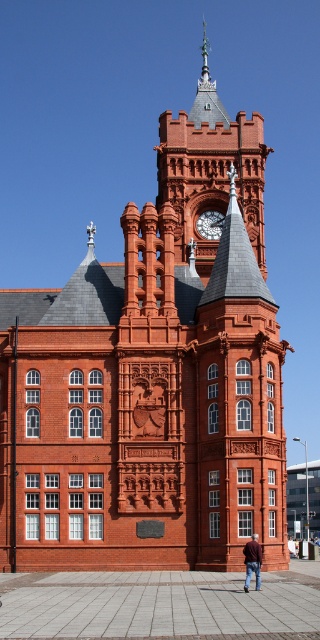
Question: Which object appears farthest from the camera in this image?

Choices:
 (A) brown leather jacket at lower center
 (B) polished brass clock at upper center

Answer: (B)

Question: Which object appears closest to the camera in this image?

Choices:
 (A) polished brass clock at upper center
 (B) brown leather jacket at lower center

Answer: (B)

Question: Is brown leather jacket at lower center behind polished brass clock at upper center?

Choices:
 (A) no
 (B) yes

Answer: (A)

Question: Can you confirm if brown leather jacket at lower center is thinner than polished brass clock at upper center?

Choices:
 (A) no
 (B) yes

Answer: (B)

Question: Does brown leather jacket at lower center have a larger size compared to polished brass clock at upper center?

Choices:
 (A) no
 (B) yes

Answer: (A)